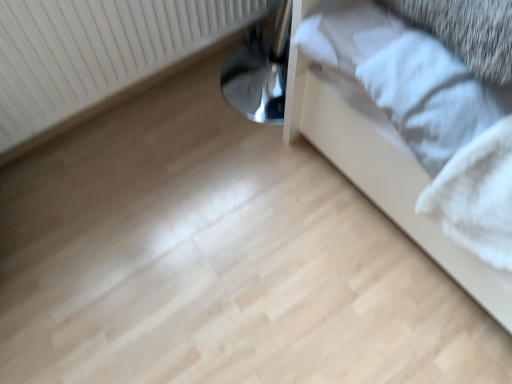
Question: Is metallic bed frame at lower right at the right side of white textured radiator at upper left?

Choices:
 (A) yes
 (B) no

Answer: (A)

Question: Is metallic bed frame at lower right oriented away from white textured radiator at upper left?

Choices:
 (A) no
 (B) yes

Answer: (A)

Question: Is metallic bed frame at lower right to the left of white textured radiator at upper left from the viewer's perspective?

Choices:
 (A) no
 (B) yes

Answer: (A)

Question: Can you confirm if metallic bed frame at lower right is taller than white textured radiator at upper left?

Choices:
 (A) yes
 (B) no

Answer: (A)

Question: Is metallic bed frame at lower right not near white textured radiator at upper left?

Choices:
 (A) yes
 (B) no

Answer: (B)

Question: Does metallic bed frame at lower right have a smaller size compared to white textured radiator at upper left?

Choices:
 (A) yes
 (B) no

Answer: (B)

Question: Can you confirm if white textured radiator at upper left is wider than metallic bed frame at lower right?

Choices:
 (A) no
 (B) yes

Answer: (A)

Question: Considering the relative sizes of white textured radiator at upper left and metallic bed frame at lower right in the image provided, is white textured radiator at upper left bigger than metallic bed frame at lower right?

Choices:
 (A) yes
 (B) no

Answer: (B)

Question: Would you say white textured radiator at upper left contains metallic bed frame at lower right?

Choices:
 (A) yes
 (B) no

Answer: (B)

Question: Is the depth of white textured radiator at upper left greater than that of metallic bed frame at lower right?

Choices:
 (A) yes
 (B) no

Answer: (A)

Question: Considering the relative positions of white textured radiator at upper left and metallic bed frame at lower right in the image provided, is white textured radiator at upper left to the left of metallic bed frame at lower right from the viewer's perspective?

Choices:
 (A) no
 (B) yes

Answer: (B)

Question: Is white textured radiator at upper left smaller than metallic bed frame at lower right?

Choices:
 (A) no
 (B) yes

Answer: (B)

Question: From a real-world perspective, is metallic bed frame at lower right above or below white textured radiator at upper left?

Choices:
 (A) above
 (B) below

Answer: (A)